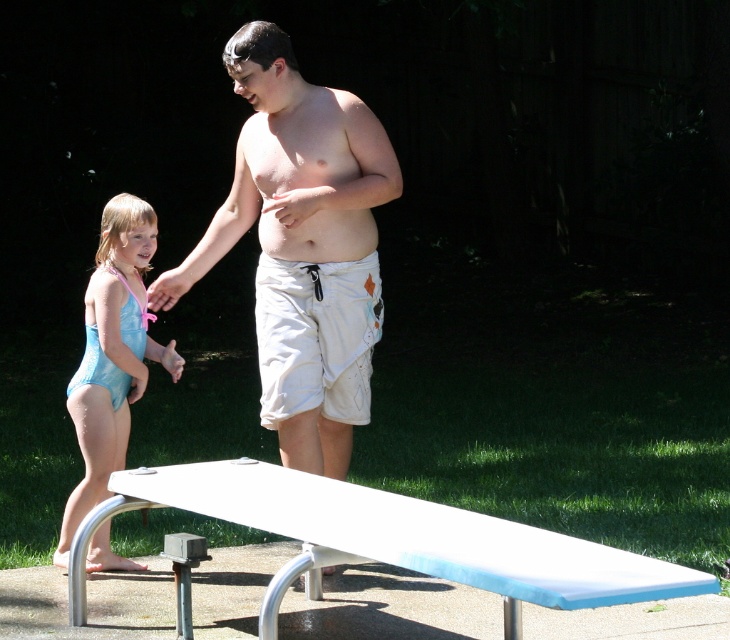
You are standing at the point labeled as point (385, 540) in the image. What object are you currently standing on?

You are standing on the white glossy diving board at center as indicated by the point (385, 540).

You are a lifeguard observing the scene. You notice the white cotton shorts at center and the light blue swimsuit at left. Which clothing item is positioned higher in the image?

The white cotton shorts at center is above the light blue swimsuit at left, so the white cotton shorts at center is positioned higher in the image.

You are standing at the edge of the pool and want to reach the light blue swimsuit at left without stepping on the white glossy diving board at center. Is this possible?

The white glossy diving board at center is closer to the viewer than the light blue swimsuit at left, so you would have to step over or around the diving board to reach the swimsuit, making it possible without stepping on it.